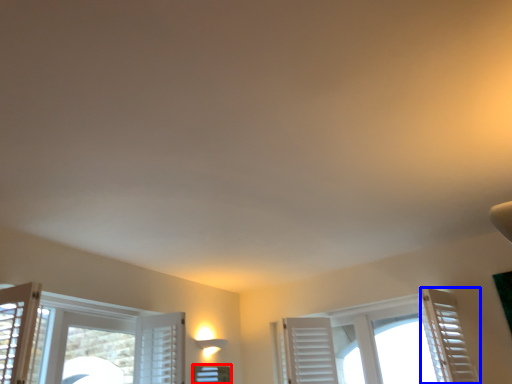
Question: Which object appears farthest to the camera in this image, window (highlighted by a red box) or curtain (highlighted by a blue box)?

Choices:
 (A) window
 (B) curtain

Answer: (A)